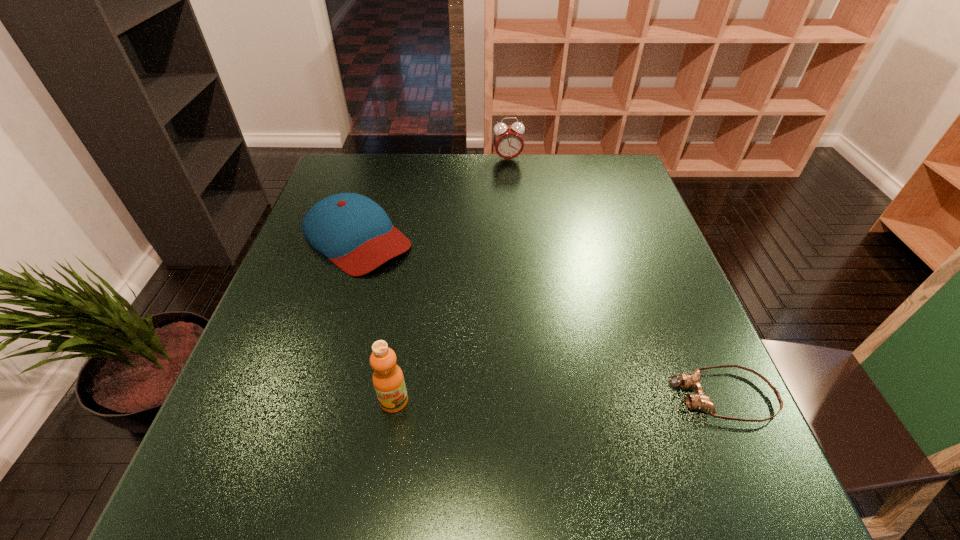
Find the location of a particular element. The image size is (960, 540). object positioned at the right edge is located at coordinates (700, 401).

Locate an element on the screen. The width and height of the screenshot is (960, 540). object that is at the near right corner is located at coordinates (700, 401).

At what (x,y) coordinates should I click in order to perform the action: click on free region at the far edge of the desktop. Please return your answer as a coordinate pair (x, y). Looking at the image, I should click on (429, 187).

The image size is (960, 540). I want to click on free region at the left edge of the desktop, so click(x=309, y=262).

Locate an element on the screen. vacant space at the right edge of the desktop is located at coordinates (690, 392).

Find the location of a particular element. Image resolution: width=960 pixels, height=540 pixels. free spot at the far left corner of the desktop is located at coordinates (340, 183).

Find the location of `free space between the shortest object and the third shortest object`. free space between the shortest object and the third shortest object is located at coordinates (614, 278).

Where is `vacant area that lies between the second tallest object and the orange juice`? The image size is (960, 540). vacant area that lies between the second tallest object and the orange juice is located at coordinates (451, 280).

Identify the location of unoccupied position between the baseball cap and the rightmost object. This screenshot has height=540, width=960. (540, 317).

Identify the location of unoccupied position between the orange juice and the baseball cap. Image resolution: width=960 pixels, height=540 pixels. (375, 319).